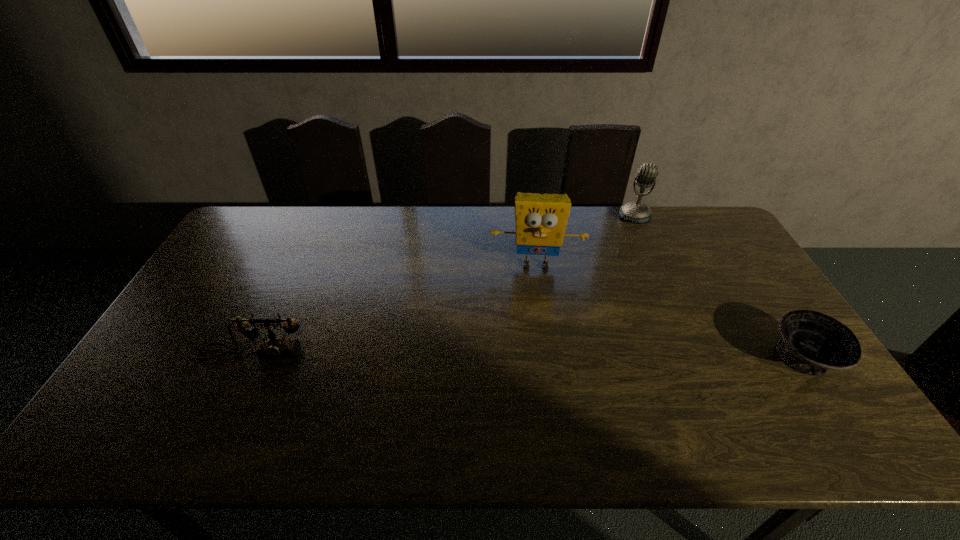
The width and height of the screenshot is (960, 540). In order to click on vacant space on the desktop that is between the telephone and the shortest object and is positioned on the face of the third object from right to left in this screenshot , I will do click(x=539, y=356).

Locate an element on the screen. The width and height of the screenshot is (960, 540). free space on the desktop that is between the third tallest object and the bowl and is positioned on the front-facing side of the microphone is located at coordinates (577, 356).